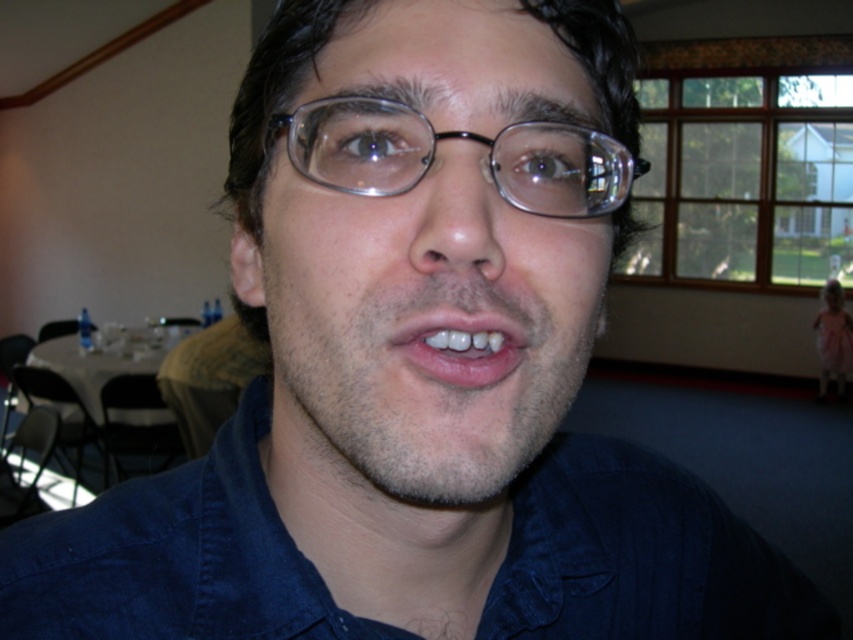
Question: Which point is closer to the camera?

Choices:
 (A) white glossy teeth at center
 (B) clear plastic glasses at center

Answer: (A)

Question: Is clear plastic glasses at center behind white glossy teeth at center?

Choices:
 (A) yes
 (B) no

Answer: (A)

Question: Is clear plastic glasses at center thinner than white glossy teeth at center?

Choices:
 (A) yes
 (B) no

Answer: (B)

Question: Can you confirm if clear plastic glasses at center is positioned to the right of white glossy teeth at center?

Choices:
 (A) no
 (B) yes

Answer: (A)